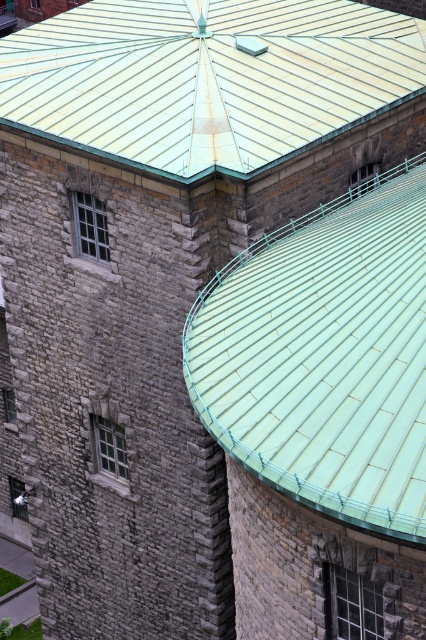
Question: Can you confirm if green metal tile roof at center is wider than metallic green roof at upper center?

Choices:
 (A) no
 (B) yes

Answer: (A)

Question: Is green metal tile roof at center smaller than metallic green roof at upper center?

Choices:
 (A) yes
 (B) no

Answer: (A)

Question: Can you confirm if green metal tile roof at center is smaller than metallic green roof at upper center?

Choices:
 (A) yes
 (B) no

Answer: (A)

Question: Among these objects, which one is farthest from the camera?

Choices:
 (A) green metal tile roof at center
 (B) metallic green roof at upper center

Answer: (B)